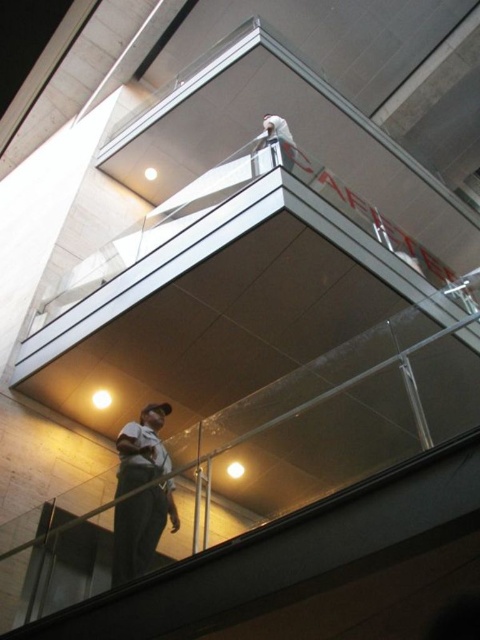
This screenshot has height=640, width=480. Find the location of `white fabric shirt at lower center`. white fabric shirt at lower center is located at coordinates (141, 529).

Does white fabric shirt at lower center appear under white matte helmet at upper center?

Yes, white fabric shirt at lower center is below white matte helmet at upper center.

Measure the distance between point (121, 464) and camera.

A distance of 15.98 feet exists between point (121, 464) and camera.

You are a GUI agent. You are given a task and a screenshot of the screen. Output one action in this format:
    pyautogui.click(x=<x>, y=<y>)
    Task: Click on the white fabric shirt at lower center
    This screenshot has width=480, height=640.
    Given the screenshot: What is the action you would take?
    pyautogui.click(x=141, y=529)